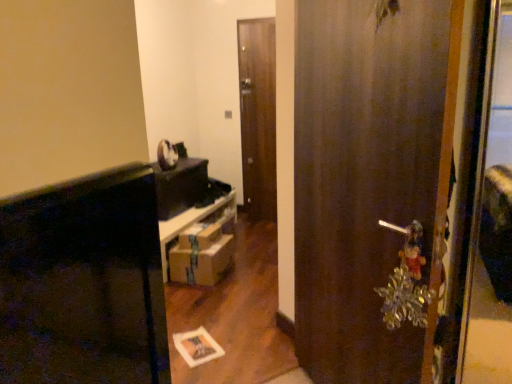
Question: Considering the relative positions of wooden door at center, which is the second door in front-to-back order, and brown cardboard drawer at center in the image provided, is wooden door at center, which is the second door in front-to-back order, to the left or to the right of brown cardboard drawer at center?

Choices:
 (A) left
 (B) right

Answer: (B)

Question: From a real-world perspective, relative to brown cardboard drawer at center, is wooden door at center, which ranks as the first door in left-to-right order, vertically above or below?

Choices:
 (A) above
 (B) below

Answer: (A)

Question: Estimate the real-world distances between objects in this image. Which object is farther from the brown cardboard drawer at center?

Choices:
 (A) wooden door at center, the second door viewed from the back
 (B) wooden door at center, which is the second door from right to left
 (C) brown cardboard boxes at center

Answer: (A)

Question: Estimate the real-world distances between objects in this image. Which object is farther from the brown cardboard boxes at center?

Choices:
 (A) brown cardboard drawer at center
 (B) wooden door at center, which is counted as the 1th door, starting from the front
 (C) wooden door at center, which is the second door in front-to-back order

Answer: (B)